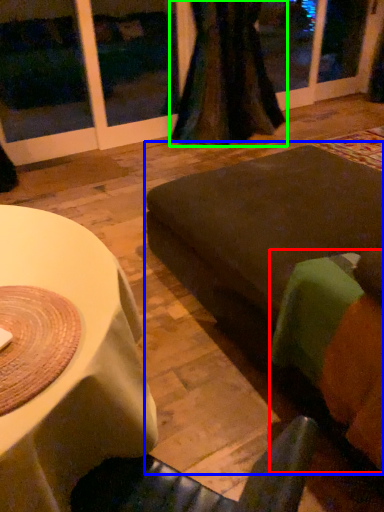
Question: Based on their relative distances, which object is farther from couch (highlighted by a red box)? Choose from couch (highlighted by a blue box) and curtain (highlighted by a green box).

Choices:
 (A) couch
 (B) curtain

Answer: (B)